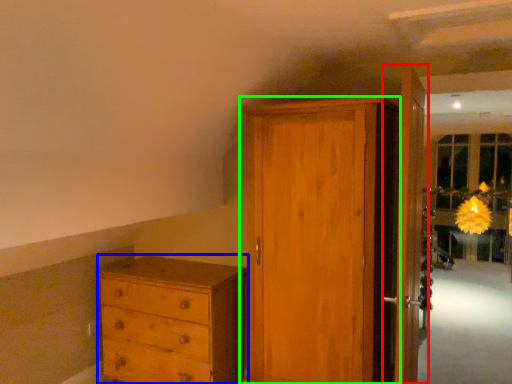
Question: Based on their relative distances, which object is farther from door (highlighted by a red box)? Choose from chest of drawers (highlighted by a blue box) and door (highlighted by a green box).

Choices:
 (A) chest of drawers
 (B) door

Answer: (A)